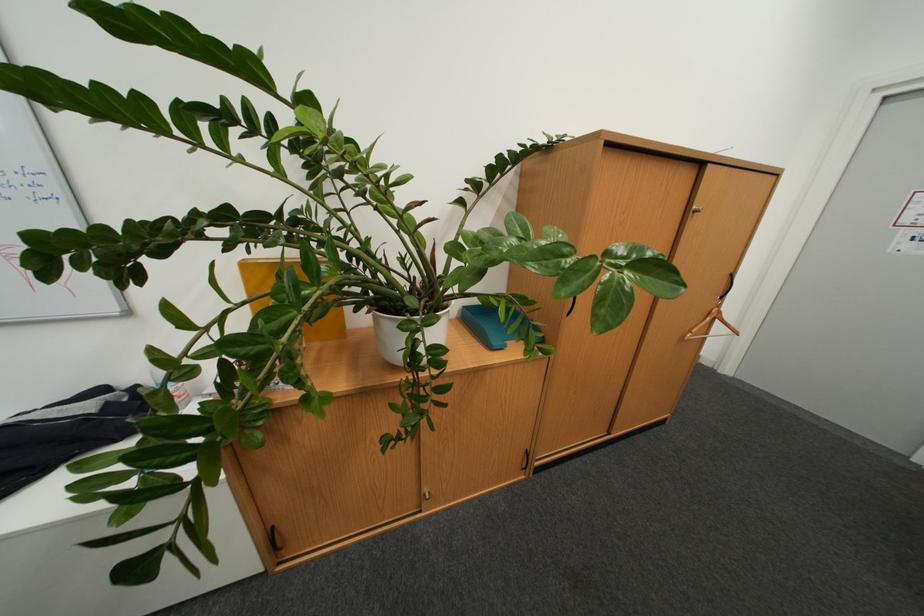
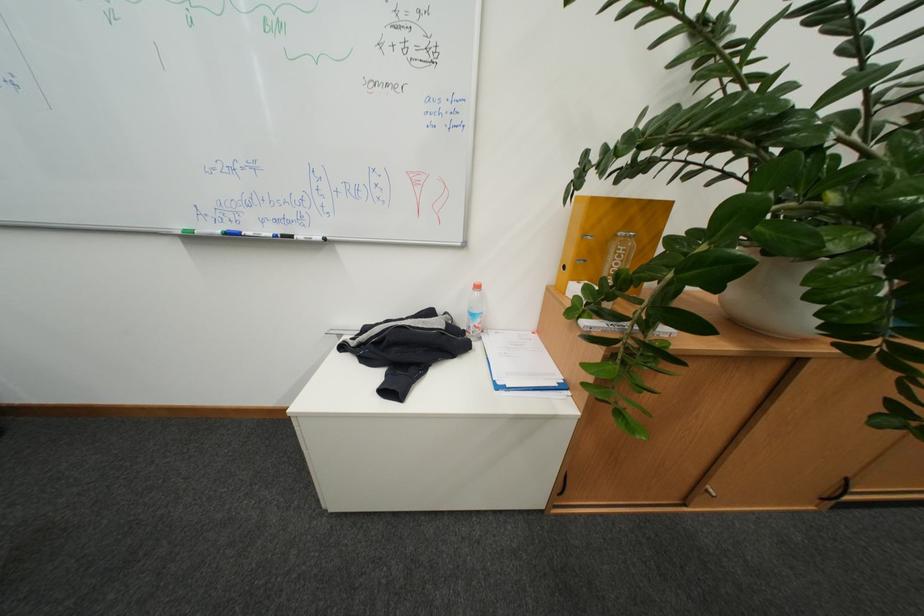
Question: The camera is either moving clockwise (left) or counter-clockwise (right) around the object. The first image is from the beginning of the video and the second image is from the end. Is the camera moving left or right when shooting the video?

Choices:
 (A) Left
 (B) Right

Answer: (B)